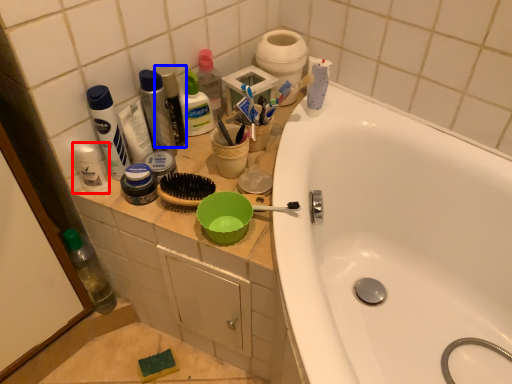
Question: Which object appears farthest to the camera in this image, toiletry (highlighted by a red box) or mouthwash (highlighted by a blue box)?

Choices:
 (A) toiletry
 (B) mouthwash

Answer: (B)